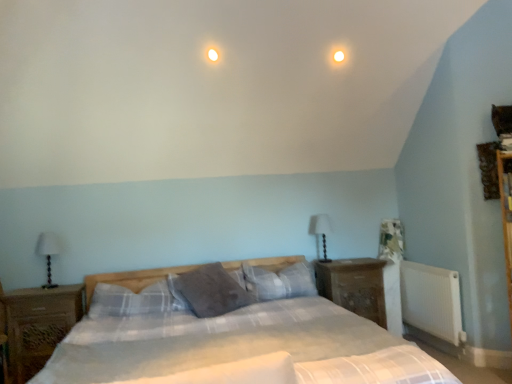
Question: From a real-world perspective, is white fabric-covered table lamp at center-right, which is the first table lamp from right to left, physically located above or below wooden nightstand at left, which is the second nightstand from right to left?

Choices:
 (A) above
 (B) below

Answer: (A)

Question: Is point (309, 223) positioned closer to the camera than point (31, 311)?

Choices:
 (A) closer
 (B) farther

Answer: (B)

Question: Estimate the real-world distances between objects in this image. Which object is closer to the wooden nightstand at left, positioned as the 1th nightstand in left-to-right order?

Choices:
 (A) white glossy light at upper center
 (B) plaid fabric bed at center
 (C) white fabric lampshade at left, marked as the 2th table lamp in a back-to-front arrangement
 (D) plaid fabric pillow at center, which is the third pillow from right to left
 (E) gray soft pillow at center, the second pillow positioned from the left

Answer: (D)

Question: Estimate the real-world distances between objects in this image. Which object is farther from the white glossy light at upper center?

Choices:
 (A) plaid fabric pillow at center, which is the third pillow from right to left
 (B) white plastic radiator at lower right
 (C) white fabric lampshade at left, marked as the 2th table lamp in a back-to-front arrangement
 (D) wooden nightstand at left, which is the second nightstand from right to left
 (E) wooden nightstand at right, which is counted as the first nightstand, starting from the right

Answer: (D)